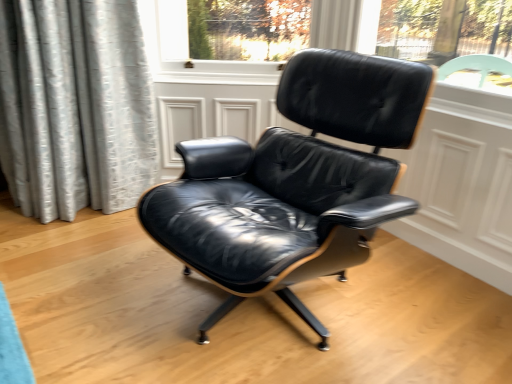
The width and height of the screenshot is (512, 384). In order to click on vacant area on top of black leather screen door at center (from a real-world perspective) in this screenshot , I will do `click(212, 82)`.